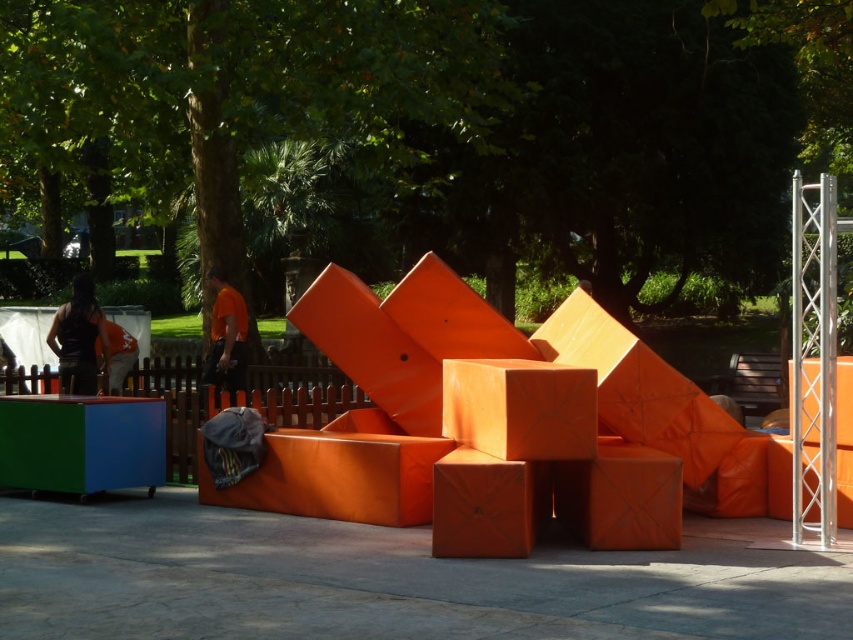
Question: Is matte orange cube at center bigger than orange matte shirt at center?

Choices:
 (A) no
 (B) yes

Answer: (B)

Question: Estimate the real-world distances between objects in this image. Which object is farther from the black fabric at left?

Choices:
 (A) matte orange cube at center
 (B) orange matte block at center
 (C) orange matte shirt at center
 (D) orange matte jacket at left

Answer: (A)

Question: Can you confirm if orange matte block at center is thinner than orange matte shirt at center?

Choices:
 (A) no
 (B) yes

Answer: (A)

Question: Which of these objects is positioned farthest from the black fabric at left?

Choices:
 (A) orange matte jacket at left
 (B) matte orange cube at center
 (C) orange matte shirt at center

Answer: (B)

Question: Which point is closer to the camera taking this photo?

Choices:
 (A) (242, 364)
 (B) (543, 438)
 (C) (529, 484)
 (D) (109, 387)

Answer: (B)

Question: Can you confirm if matte orange cube at center is positioned to the right of orange matte shirt at center?

Choices:
 (A) yes
 (B) no

Answer: (A)